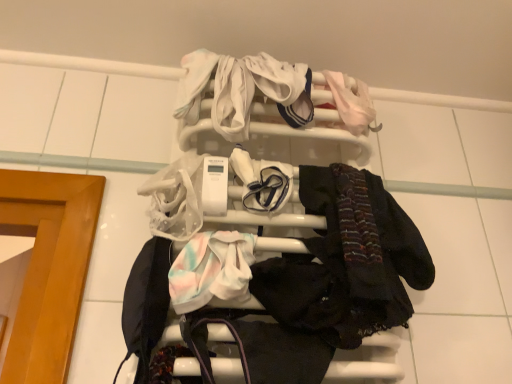
Question: Looking at their shapes, would you say dark matte scarf at center right is wider or thinner than white soft fabric at center, the 2th baby clothe from the bottom?

Choices:
 (A) thin
 (B) wide

Answer: (B)

Question: Visually, is dark matte scarf at center right positioned to the left or to the right of white soft fabric at center, acting as the 2th baby clothe starting from the right?

Choices:
 (A) left
 (B) right

Answer: (B)

Question: Based on their relative distances, which object is nearer to the dark matte scarf at center right?

Choices:
 (A) pastel tie-dye fabric at center, the third baby clothe in the right-to-left sequence
 (B) pale pink fabric at upper right, arranged as the first baby clothe when viewed from the back
 (C) white plastic towel rack at upper center
 (D) white soft fabric at center, acting as the 2th baby clothe starting from the right

Answer: (C)

Question: Which object is the farthest from the dark matte scarf at center right?

Choices:
 (A) white plastic towel rack at upper center
 (B) pale pink fabric at upper right, the first baby clothe in the right-to-left sequence
 (C) pastel tie-dye fabric at center, the 3th baby clothe viewed from the top
 (D) white soft fabric at center, which is the 2th baby clothe in top-to-bottom order

Answer: (B)